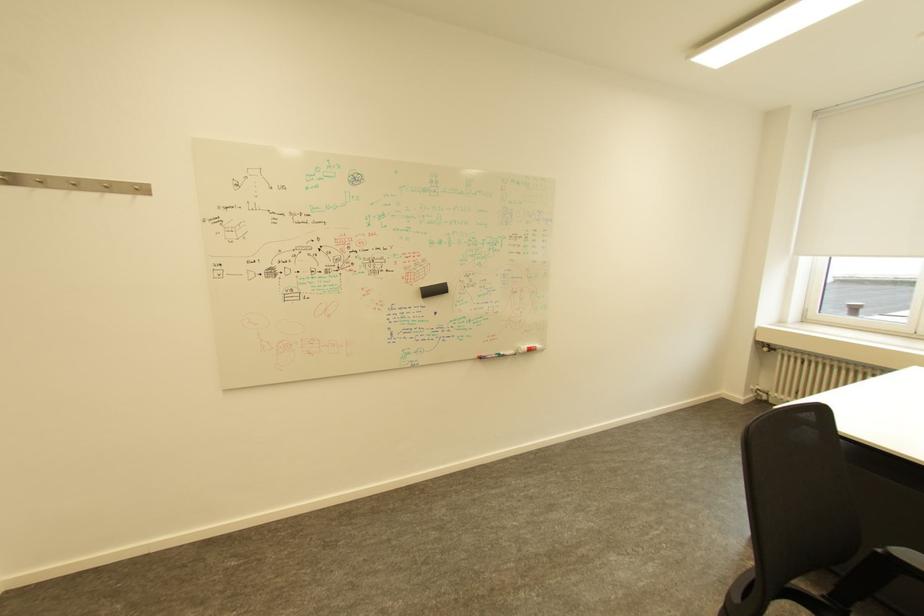
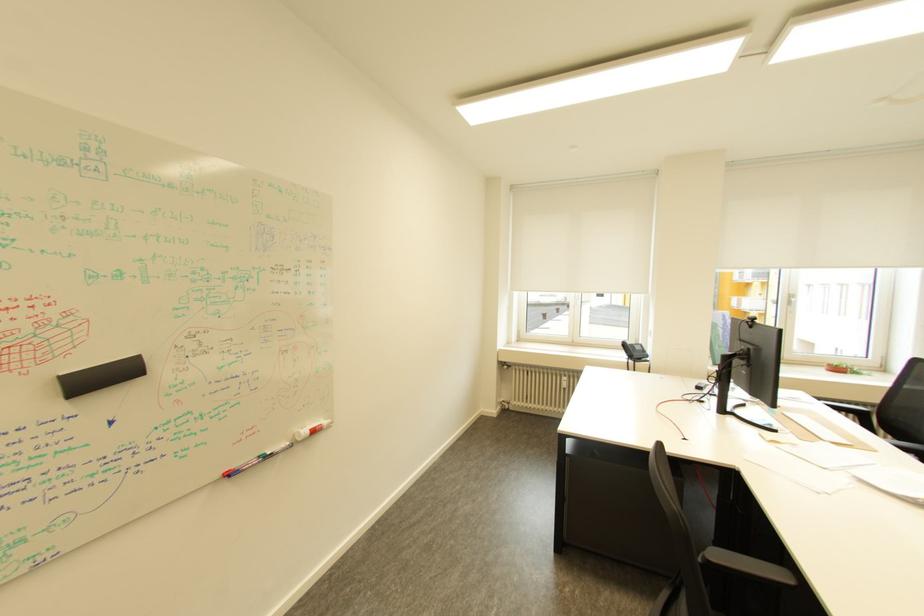
Question: The first image is from the beginning of the video and the second image is from the end. How did the camera likely rotate when shooting the video?

Choices:
 (A) Left
 (B) Right
 (C) Up
 (D) Down

Answer: (B)